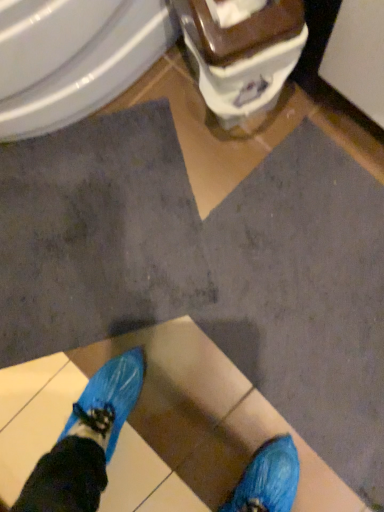
Question: Is brown glossy toilet at upper center wider or thinner than white glossy bidet at upper left?

Choices:
 (A) thin
 (B) wide

Answer: (A)

Question: Based on their sizes in the image, would you say brown glossy toilet at upper center is bigger or smaller than white glossy bidet at upper left?

Choices:
 (A) small
 (B) big

Answer: (A)

Question: Visually, is brown glossy toilet at upper center positioned to the left or to the right of white glossy bidet at upper left?

Choices:
 (A) left
 (B) right

Answer: (B)

Question: Relative to brown glossy toilet at upper center, is white glossy bidet at upper left in front or behind?

Choices:
 (A) behind
 (B) front

Answer: (A)

Question: In the image, is white glossy bidet at upper left on the left side or the right side of brown glossy toilet at upper center?

Choices:
 (A) left
 (B) right

Answer: (A)

Question: Is white glossy bidet at upper left situated inside brown glossy toilet at upper center or outside?

Choices:
 (A) outside
 (B) inside

Answer: (A)

Question: Is point (163, 29) positioned closer to the camera than point (198, 39)?

Choices:
 (A) closer
 (B) farther

Answer: (B)